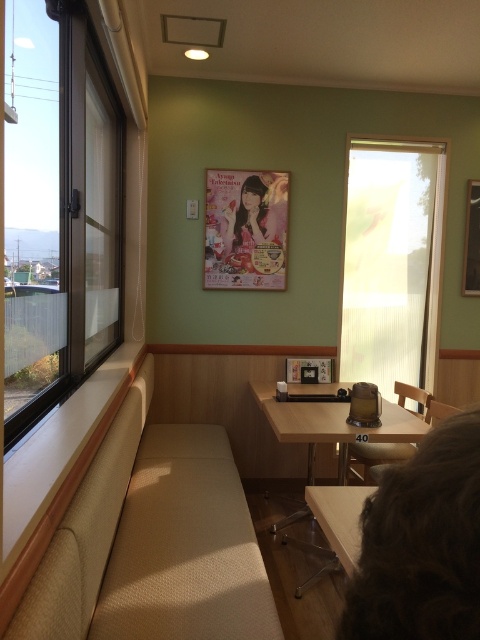
You are a customer sitting in the wooden chair at center and want to read the matte paper poster at center. Can you reach it without getting up?

The matte paper poster at center and wooden chair at center are 4.68 feet apart, so you would need to get up to reach the poster as it is too far to read while sitting in the wooden chair at center.

You are designing a layout for a new menu board that needs to be placed between the matte paper poster at center and the wooden chair at center. The menu board is 1.2 meters wide. Can the space between them accommodate the menu board?

The matte paper poster at center is narrower than the wooden chair at center. However, the exact distance between them isn not specified in the provided description. Therefore, it is uncertain whether the 1.2 meter wide menu board will fit without more information about the spacing between the two objects.

You are taking a photo of the framed poster in the corner of the cafe. You notice two points marked on the poster at coordinates point (115, 132) and point (274, 397). Which point should you focus on to ensure the poster is in sharp focus without moving the camera?

You should focus on point (115, 132) because it is closer to the camera than point (274, 397), ensuring the poster is in focus.